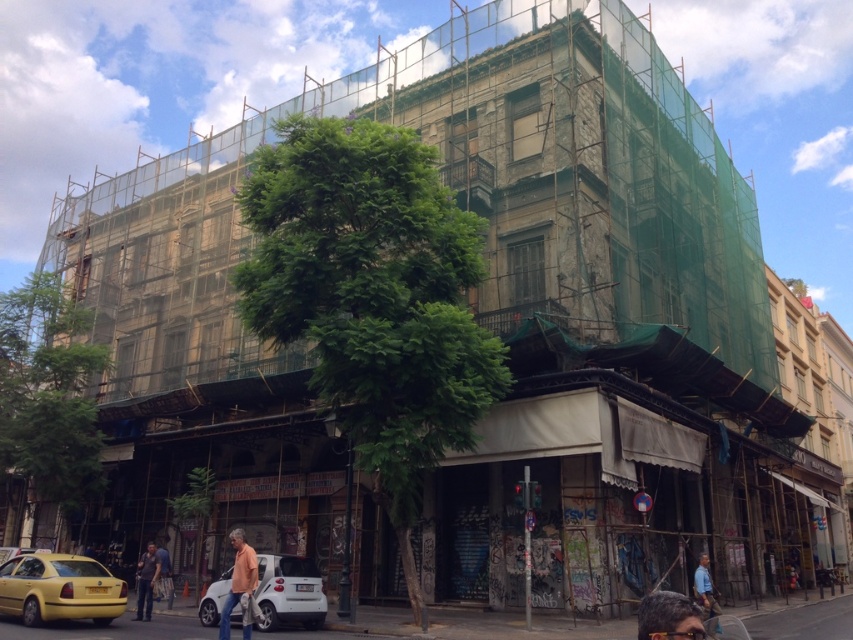
You are a pedestrian standing in front of the building and you see the dark blue jeans at lower left and the blue shirt at lower right. Which one is closer to the ground?

The dark blue jeans at lower left is below blue shirt at lower right, so the dark blue jeans at lower left is closer to the ground.

You are a delivery person trying to park your white matte car at lower center near the dark blue jeans at lower left. Given that the parking space is only 1.5 meters wide, can your car fit?

The white matte car at lower center is bigger than the dark blue jeans at lower left, but the size comparison between the car and the parking space isn not provided. Therefore, it is unclear if the car can fit in the 1.5 meter wide space.